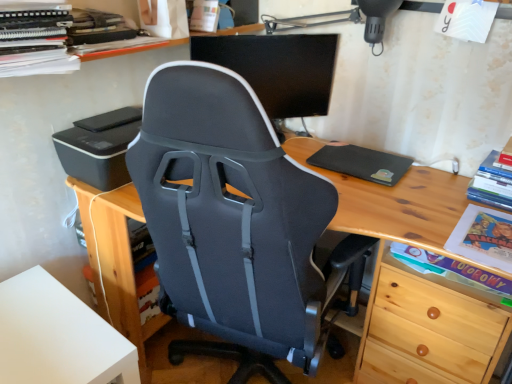
The image size is (512, 384). In order to click on free space above black matte/black rubberized mousepad at right (from a real-world perspective) in this screenshot , I will do click(352, 154).